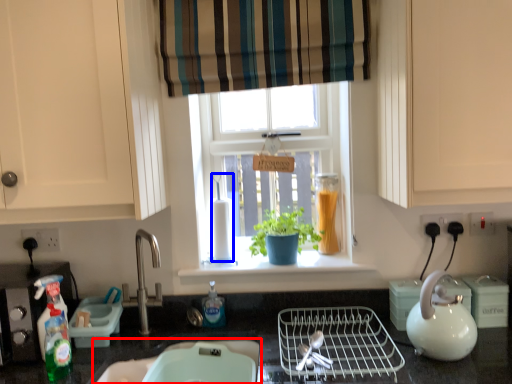
Question: Which of the following is the closest to the observer, sink (highlighted by a red box) or blender (highlighted by a blue box)?

Choices:
 (A) sink
 (B) blender

Answer: (A)